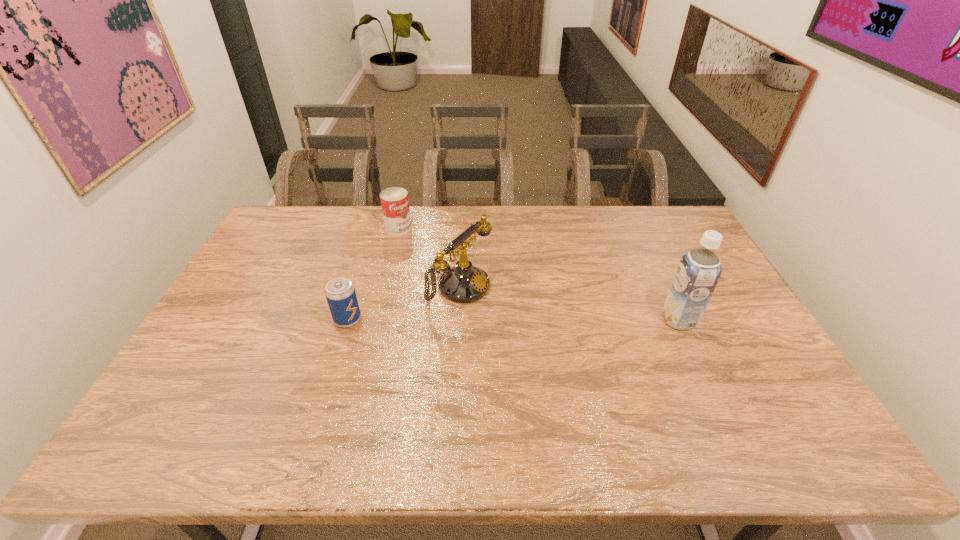
What are the coordinates of `vacant point at the left edge` in the screenshot? It's located at (260, 292).

Locate an element on the screen. Image resolution: width=960 pixels, height=540 pixels. free space at the right edge is located at coordinates (725, 323).

In the image, there is a desktop. Where is `vacant space at the far left corner`? This screenshot has width=960, height=540. vacant space at the far left corner is located at coordinates (275, 242).

Image resolution: width=960 pixels, height=540 pixels. What are the coordinates of `free region at the far right corner of the desktop` in the screenshot? It's located at (685, 241).

Where is `free space between the third shortest object and the rightmost object`? The height and width of the screenshot is (540, 960). free space between the third shortest object and the rightmost object is located at coordinates coord(568,303).

Locate an element on the screen. This screenshot has width=960, height=540. empty space between the third object from left to right and the beer can is located at coordinates (403, 303).

Identify the location of empty location between the farthest object and the third shortest object. (428, 258).

You are a GUI agent. You are given a task and a screenshot of the screen. Output one action in this format:
    pyautogui.click(x=<x>, y=<y>)
    Task: Click on the empty location between the can and the beer can
    
    Given the screenshot: What is the action you would take?
    pyautogui.click(x=373, y=274)

Locate an element on the screen. The height and width of the screenshot is (540, 960). free space between the beer can and the farthest object is located at coordinates (373, 274).

Identify the location of vacant space that's between the soya milk and the third object from left to right. (568, 303).